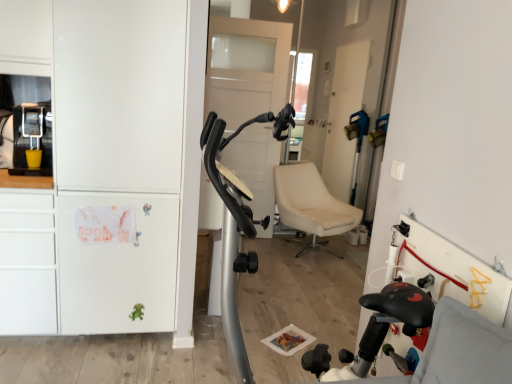
Question: From a real-world perspective, is white matte cabinet at left positioned above or below matte black coffee machine at left?

Choices:
 (A) below
 (B) above

Answer: (A)

Question: In the image, is white matte cabinet at left positioned in front of or behind matte black coffee machine at left?

Choices:
 (A) behind
 (B) front

Answer: (B)

Question: Is white matte cabinet at left wider or thinner than matte black coffee machine at left?

Choices:
 (A) thin
 (B) wide

Answer: (B)

Question: Is matte black coffee machine at left to the left or to the right of white matte cabinet at left in the image?

Choices:
 (A) left
 (B) right

Answer: (A)

Question: In the image, is matte black coffee machine at left positioned in front of or behind white matte cabinet at left?

Choices:
 (A) behind
 (B) front

Answer: (A)

Question: Considering the positions of matte black coffee machine at left and white matte cabinet at left in the image, is matte black coffee machine at left wider or thinner than white matte cabinet at left?

Choices:
 (A) thin
 (B) wide

Answer: (A)

Question: From the image's perspective, is matte black coffee machine at left above or below white matte cabinet at left?

Choices:
 (A) above
 (B) below

Answer: (A)